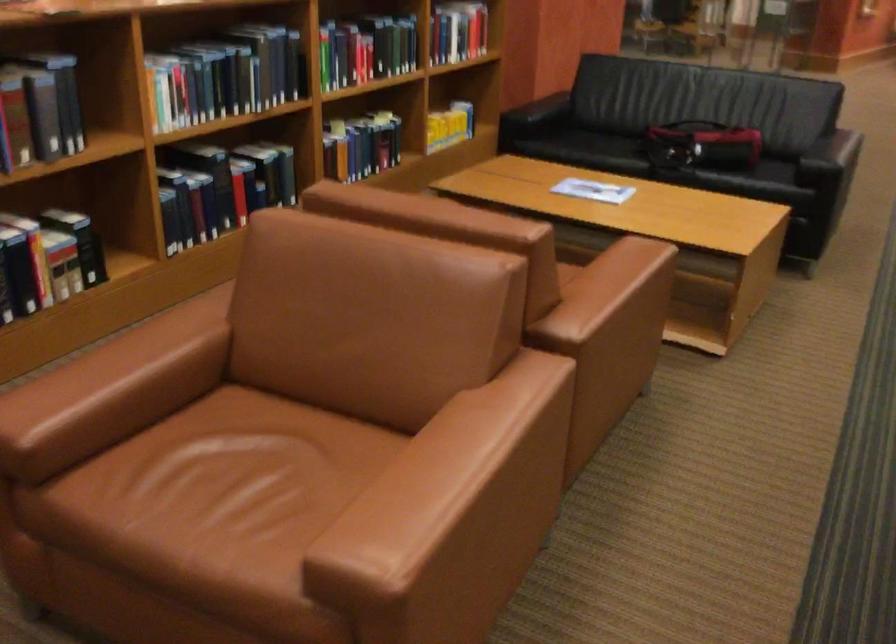
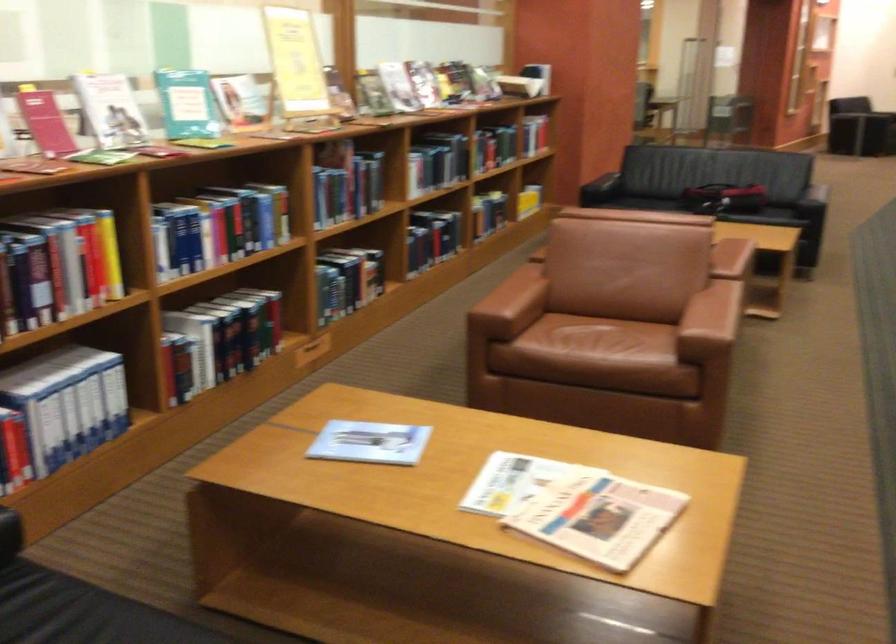
Find the pixel in the second image that matches [70,398] in the first image.

(510, 305)